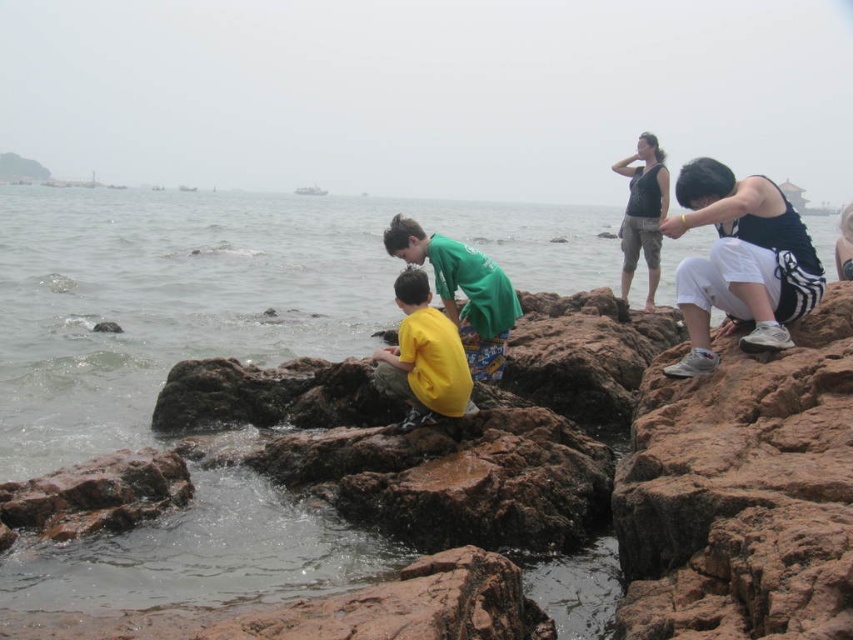
In the scene shown: You are a photographer trying to capture the scene of the rocky shoreline. You notice the white athletic pants at right and the dark green fabric shirt at upper center. Which clothing item appears narrower in the photo?

The white athletic pants at right appear narrower than the dark green fabric shirt at upper center in the photo because its width is less than the latter.

You are a photographer trying to capture a candid shot of the yellow matte shirt at center and the dark green fabric shirt at upper center. Since you want to ensure both subjects are in focus, you need to know their heights relative to each other. Which of the two is shorter?

The yellow matte shirt at center is not as tall as the dark green fabric shirt at upper center, meaning the yellow matte shirt at center is shorter.